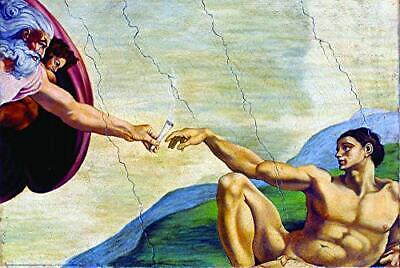
The width and height of the screenshot is (400, 268). Find the location of `chest`. chest is located at coordinates (349, 200).